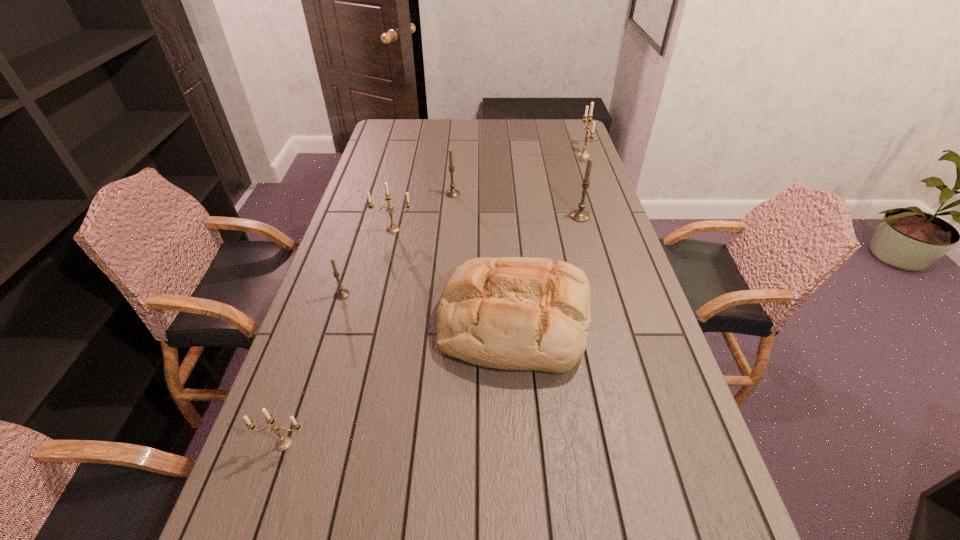
Identify the location of the second nearest candle. This screenshot has height=540, width=960. (342, 293).

Locate an element on the screen. the nearest candle is located at coordinates (284, 443).

Image resolution: width=960 pixels, height=540 pixels. I want to click on the smallest metallic candle, so click(x=284, y=443).

The height and width of the screenshot is (540, 960). What are the coordinates of `vacant area located 0.060m on the back of the farthest object` in the screenshot? It's located at (578, 139).

Where is `vacant space located on the left of the sixth object from left to right`? The height and width of the screenshot is (540, 960). vacant space located on the left of the sixth object from left to right is located at coordinates (469, 217).

Where is `vacant space located 0.190m on the back of the fourth candle from left to right`? vacant space located 0.190m on the back of the fourth candle from left to right is located at coordinates (455, 165).

This screenshot has height=540, width=960. I want to click on vacant space located on the back of the second farthest metallic candle, so (403, 186).

The width and height of the screenshot is (960, 540). I want to click on free region located on the front of the bread, so click(x=522, y=423).

Identify the location of vacant space situated 0.160m on the front of the second nearest candle. (326, 345).

This screenshot has width=960, height=540. Identify the location of blank space located on the back of the nearest candle. (294, 415).